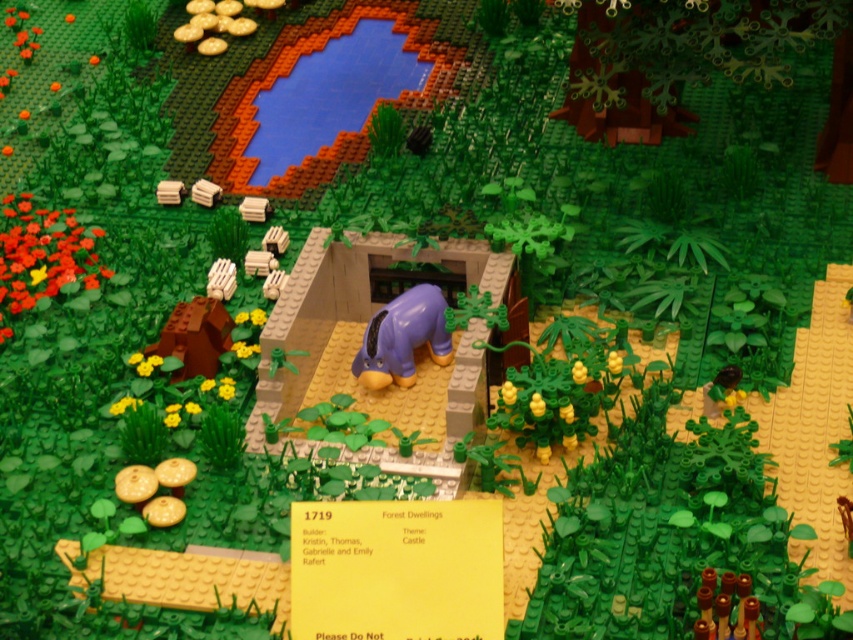
Does brown matte house at lower left have a lesser width compared to wooden block at upper left?

No, brown matte house at lower left is not thinner than wooden block at upper left.

Is point (187, 365) in front of point (161, 192)?

Yes, it is.

The image size is (853, 640). What are the coordinates of `brown matte house at lower left` in the screenshot? It's located at (194, 337).

Can you confirm if matte purple elephant at center is shorter than wooden block at upper left?

Incorrect, matte purple elephant at center's height does not fall short of wooden block at upper left's.

Locate an element on the screen. This screenshot has width=853, height=640. matte purple elephant at center is located at coordinates 403,339.

You are a GUI agent. You are given a task and a screenshot of the screen. Output one action in this format:
    pyautogui.click(x=<x>, y=<y>)
    Task: Click on the matte purple elephant at center
    
    Given the screenshot: What is the action you would take?
    tap(403, 339)

How much distance is there between wooden crates at upper center and wooden block at upper left?

A distance of 2.47 inches exists between wooden crates at upper center and wooden block at upper left.

Who is lower down, wooden crates at upper center or wooden block at upper left?

wooden crates at upper center

Image resolution: width=853 pixels, height=640 pixels. I want to click on wooden crates at upper center, so click(206, 193).